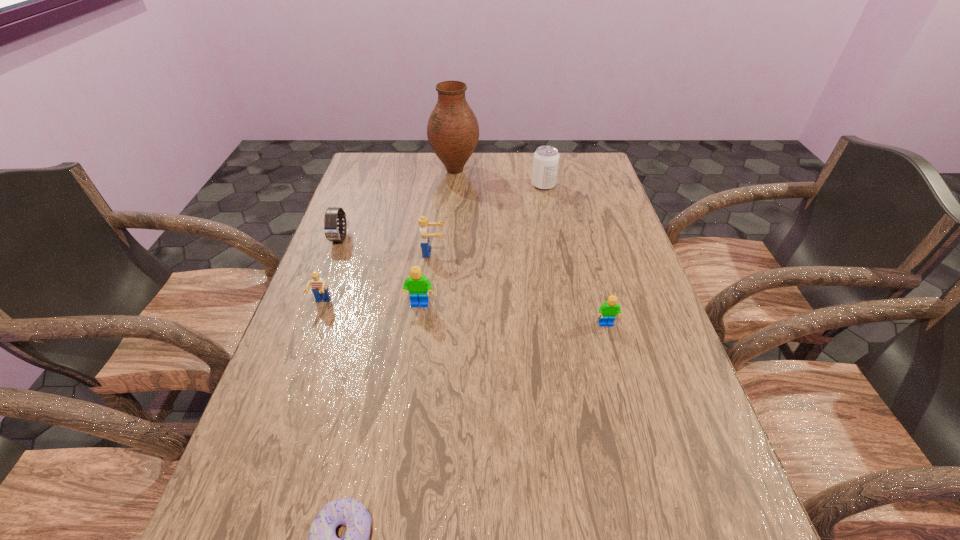
The image size is (960, 540). I want to click on the tallest object, so click(x=452, y=131).

Where is `the seventh object from left to right`? the seventh object from left to right is located at coordinates (546, 158).

Where is `the right blue Lego`? the right blue Lego is located at coordinates (422, 221).

The height and width of the screenshot is (540, 960). Find the location of `the farther blue Lego`. the farther blue Lego is located at coordinates (422, 221).

Where is `the left green Lego`? This screenshot has width=960, height=540. the left green Lego is located at coordinates (418, 286).

Identify the location of the farther green Lego. The height and width of the screenshot is (540, 960). (418, 286).

Find the location of `watch`. watch is located at coordinates (332, 233).

Where is `the nearer blue Lego`? The width and height of the screenshot is (960, 540). the nearer blue Lego is located at coordinates (319, 287).

Locate an element on the screen. The height and width of the screenshot is (540, 960). the left blue Lego is located at coordinates (319, 287).

Where is `the nearer green Lego`? The width and height of the screenshot is (960, 540). the nearer green Lego is located at coordinates (607, 311).